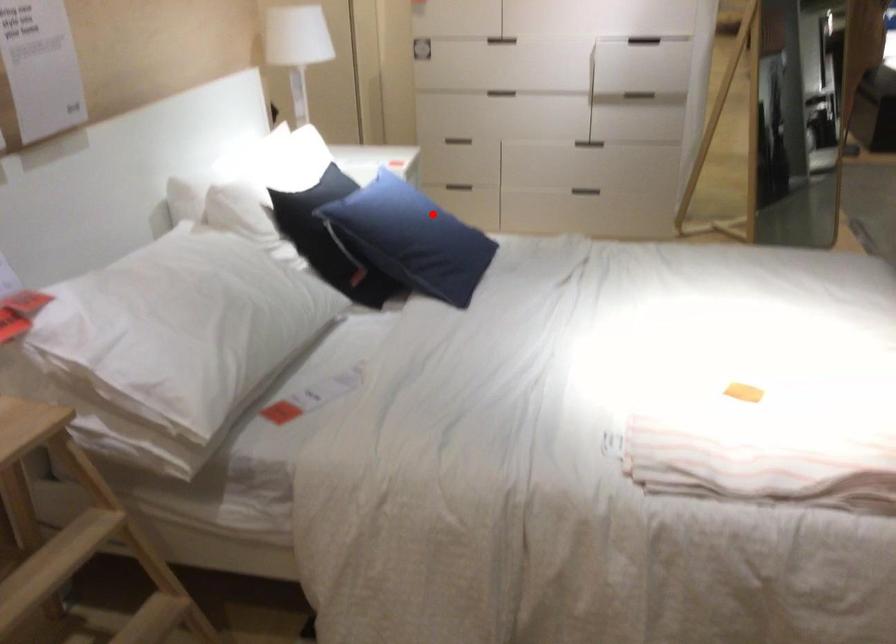
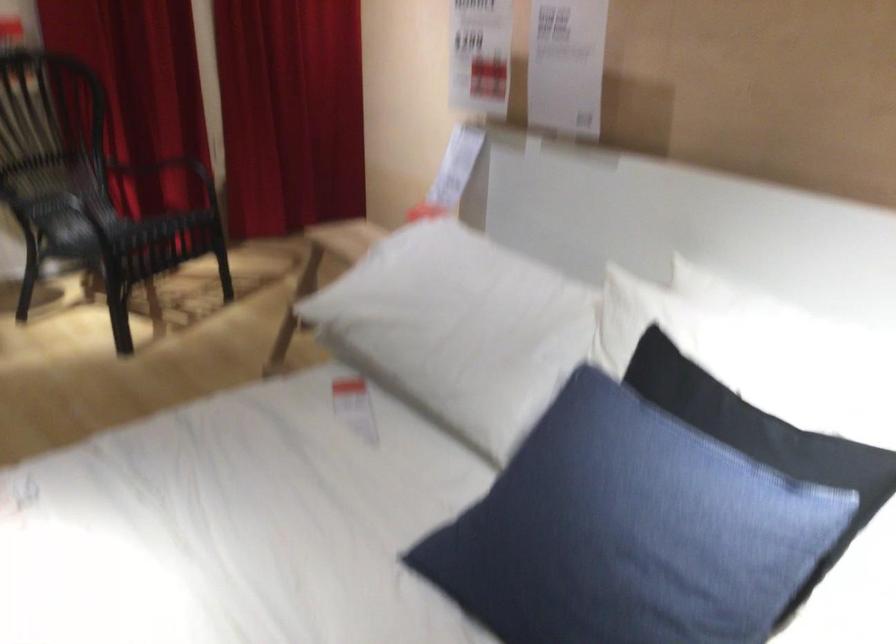
Question: I am providing you with two images of the same scene from different viewpoints. In image1, a red point is highlighted. Considering the same 3D point in image2, which of the following is correct?

Choices:
 (A) It is closer
 (B) It is farther

Answer: (A)